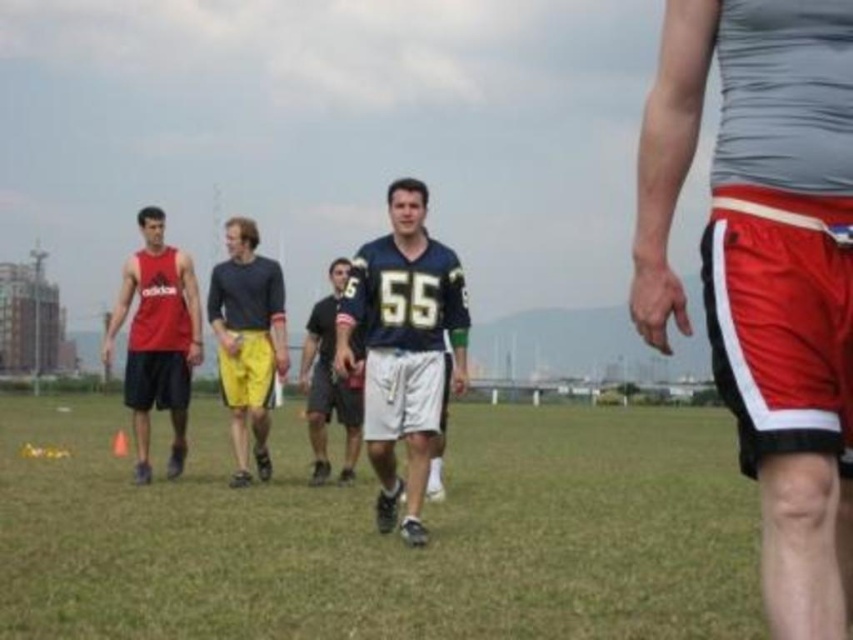
Question: Which point is farther to the camera?

Choices:
 (A) green grass at center
 (B) matte red tank top at left

Answer: (B)

Question: Does red shiny shorts at center appear over matte red tank top at left?

Choices:
 (A) yes
 (B) no

Answer: (A)

Question: Based on their relative distances, which object is farther from the blue jersey at center?

Choices:
 (A) dark gray knit sweater at center
 (B) red shiny shorts at center
 (C) dark blue jersey at center
 (D) matte red tank top at left

Answer: (B)

Question: Which of these objects is positioned closest to the green grass at center?

Choices:
 (A) matte red tank top at left
 (B) dark gray knit sweater at center

Answer: (B)

Question: Does red shiny shorts at center appear on the right side of dark blue jersey at center?

Choices:
 (A) yes
 (B) no

Answer: (A)

Question: Does blue jersey at center have a smaller size compared to dark gray knit sweater at center?

Choices:
 (A) yes
 (B) no

Answer: (A)